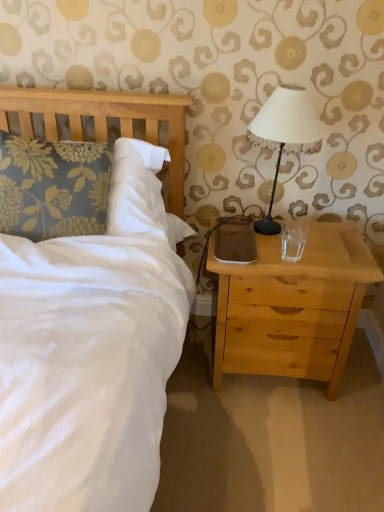
The image size is (384, 512). I want to click on vacant location below white fabric-covered lampshade at upper right (from a real-world perspective), so click(x=282, y=231).